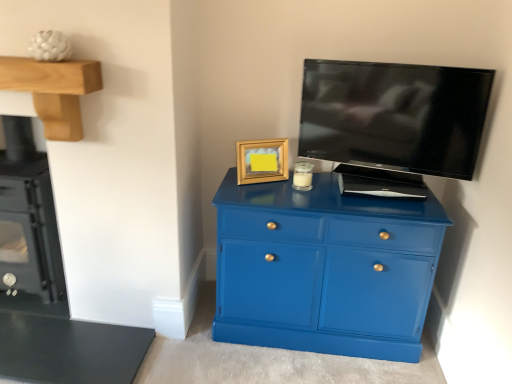
Where is `vacant area that lies between gold wooden picture frame at upper center and translucent glass candle at center`? This screenshot has width=512, height=384. vacant area that lies between gold wooden picture frame at upper center and translucent glass candle at center is located at coordinates (274, 185).